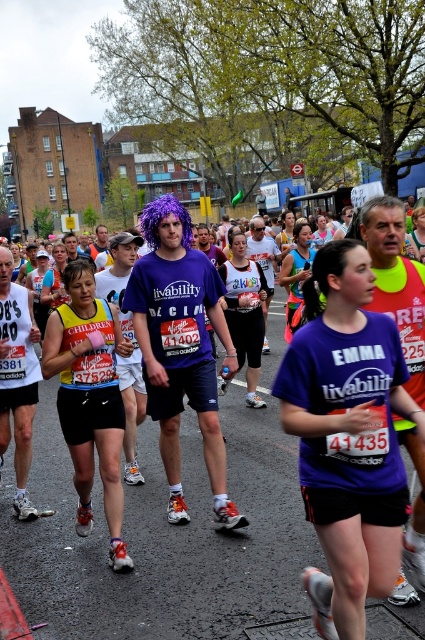
Question: Which point is farther to the camera?

Choices:
 (A) purple synthetic wig at center
 (B) purple fabric shirt at center
 (C) yellow reflective vest at center

Answer: (A)

Question: Is purple fabric shirt at center to the right of yellow reflective vest at center from the viewer's perspective?

Choices:
 (A) yes
 (B) no

Answer: (A)

Question: Does purple fabric shirt at center appear over yellow reflective vest at center?

Choices:
 (A) no
 (B) yes

Answer: (B)

Question: Which object is positioned farthest from the yellow reflective vest at center?

Choices:
 (A) purple fabric shirt at center
 (B) purple synthetic wig at center

Answer: (A)

Question: Is purple fabric shirt at center smaller than yellow reflective vest at center?

Choices:
 (A) yes
 (B) no

Answer: (A)

Question: Among these objects, which one is farthest from the camera?

Choices:
 (A) purple fabric shirt at center
 (B) yellow reflective vest at center

Answer: (B)